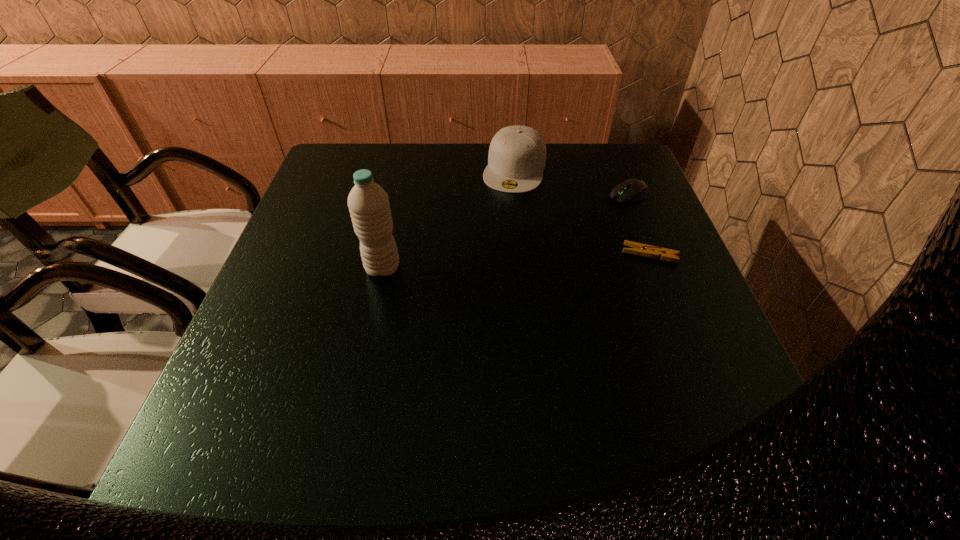
The image size is (960, 540). I want to click on free space in the image that satisfies the following two spatial constraints: 1. on the back side of the shortest object; 2. on the left side of the water bottle, so click(386, 254).